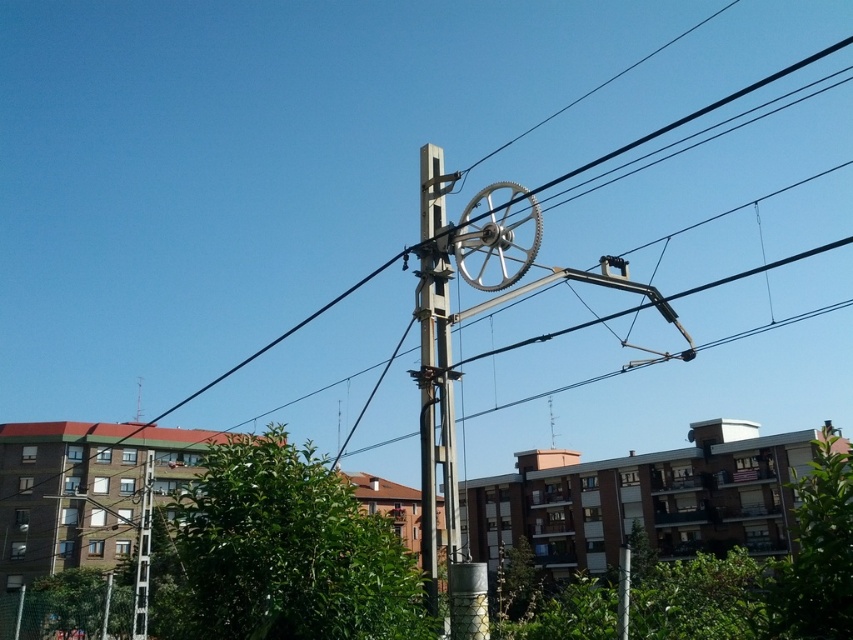
You are standing at the base of the utility pole and looking up. You see two points marked in the image. Which point, point [445,486] or point [144,502], is closer to your line of sight?

Point [445,486] is in front of point [144,502], so it is closer to your line of sight.

Consider the image. You are a city planner analyzing the image of two telegraph poles. Which pole, the metallic gray telegraph pole at center or the white plastic telegraph pole at left, would require more space for installation due to its size?

The metallic gray telegraph pole at center is bigger than the white plastic telegraph pole at left, so it would require more space for installation due to its larger size.

You are standing in a park and see the metallic gray telegraph pole at center. If you walk straight towards it for 3 meters, will you reach the pole?

The metallic gray telegraph pole at center is 4.44 meters away from you. After walking 3 meters towards it, you will still be 1.44 meters away from the pole, so you have not reached it yet.